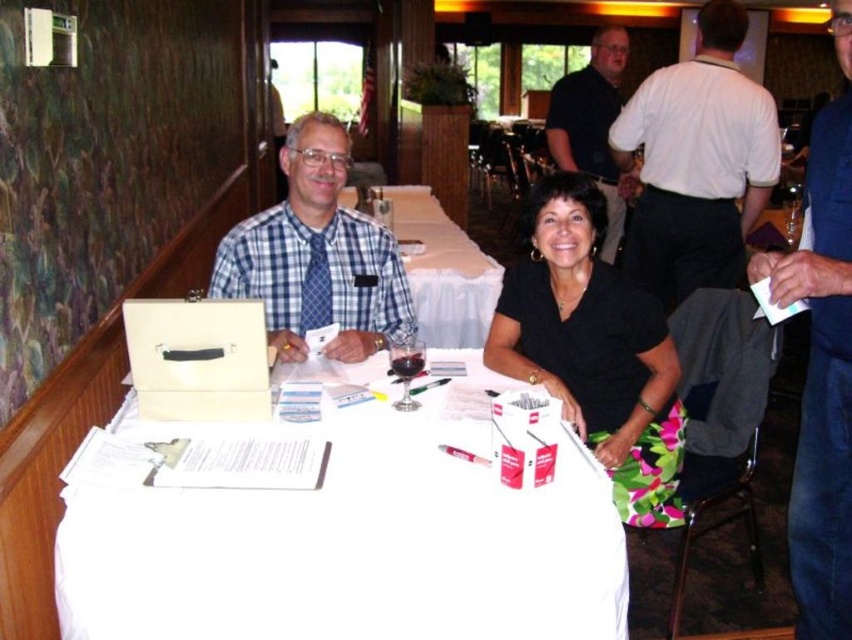
Question: Is black fabric skirt at lower center to the left of blue checkered shirt at center from the viewer's perspective?

Choices:
 (A) yes
 (B) no

Answer: (B)

Question: Which point appears closest to the camera in this image?

Choices:
 (A) (827, 502)
 (B) (540, 272)
 (C) (455, 241)
 (D) (631, 179)

Answer: (A)

Question: From the image, what is the correct spatial relationship of black fabric skirt at lower center in relation to white shirt at center?

Choices:
 (A) below
 (B) above

Answer: (A)

Question: Which point appears farthest from the camera in this image?

Choices:
 (A) (810, 598)
 (B) (649, 147)

Answer: (B)

Question: Among these points, which one is nearest to the camera?

Choices:
 (A) (648, 220)
 (B) (439, 208)
 (C) (643, 314)
 (D) (548, 109)

Answer: (C)

Question: Is white shirt at center thinner than matte black shirt at upper center?

Choices:
 (A) yes
 (B) no

Answer: (B)